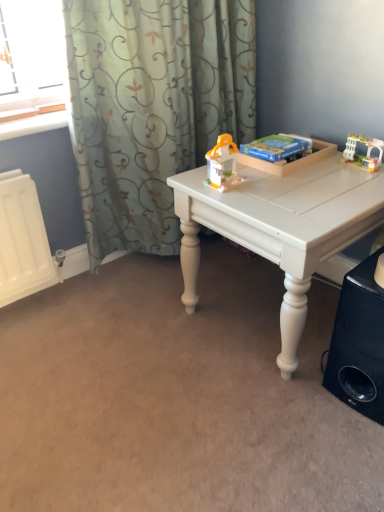
Question: Is translucent plastic toy at center, which ranks as the second toy in right-to-left order, bigger than white matte table at center?

Choices:
 (A) no
 (B) yes

Answer: (A)

Question: Can you confirm if translucent plastic toy at center, which ranks as the second toy in right-to-left order, is smaller than white matte table at center?

Choices:
 (A) yes
 (B) no

Answer: (A)

Question: Is translucent plastic toy at center, which ranks as the second toy in right-to-left order, positioned before white matte table at center?

Choices:
 (A) no
 (B) yes

Answer: (A)

Question: Considering the relative positions of translucent plastic toy at center, which ranks as the first toy in left-to-right order, and white matte table at center in the image provided, is translucent plastic toy at center, which ranks as the first toy in left-to-right order, to the right of white matte table at center from the viewer's perspective?

Choices:
 (A) yes
 (B) no

Answer: (B)

Question: Does translucent plastic toy at center, which ranks as the first toy in left-to-right order, have a greater width compared to white matte table at center?

Choices:
 (A) yes
 (B) no

Answer: (B)

Question: Is translucent plastic toy at center, which ranks as the first toy in left-to-right order, not within white matte table at center?

Choices:
 (A) yes
 (B) no

Answer: (A)

Question: Is satin green curtain at upper left wider than translucent plastic toy at center, which ranks as the second toy in right-to-left order?

Choices:
 (A) no
 (B) yes

Answer: (B)

Question: Could translucent plastic toy at center, which ranks as the second toy in right-to-left order, be considered to be inside satin green curtain at upper left?

Choices:
 (A) yes
 (B) no

Answer: (B)

Question: Could you tell me if satin green curtain at upper left is facing translucent plastic toy at center, which ranks as the first toy in left-to-right order?

Choices:
 (A) yes
 (B) no

Answer: (A)

Question: Is satin green curtain at upper left in front of translucent plastic toy at center, which ranks as the second toy in right-to-left order?

Choices:
 (A) yes
 (B) no

Answer: (A)

Question: From the image's perspective, is satin green curtain at upper left beneath translucent plastic toy at center, which ranks as the second toy in right-to-left order?

Choices:
 (A) no
 (B) yes

Answer: (A)

Question: From a real-world perspective, is satin green curtain at upper left positioned under translucent plastic toy at center, which ranks as the second toy in right-to-left order, based on gravity?

Choices:
 (A) no
 (B) yes

Answer: (B)

Question: Is translucent plastic toy at center, which ranks as the first toy in left-to-right order, outside of black matte speaker at lower right?

Choices:
 (A) yes
 (B) no

Answer: (A)